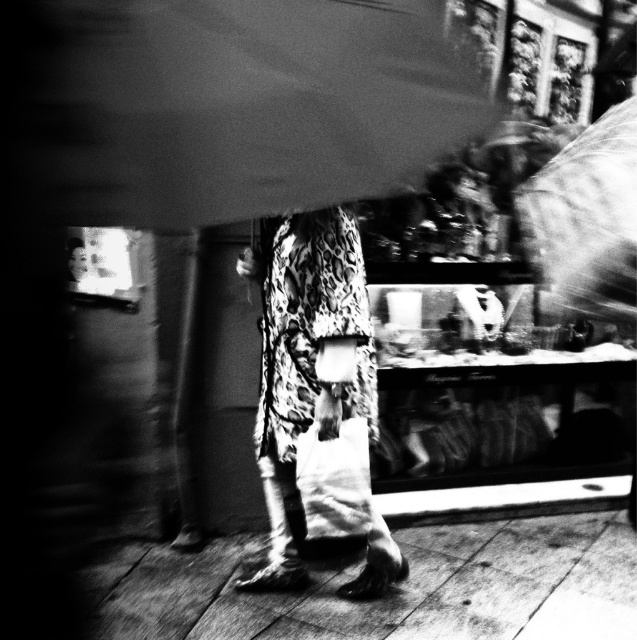
Is point (513, 586) positioned before point (280, 456)?

No, it is not.

Looking at this image, does smooth wooden floor at lower center appear on the left side of leopard print dress at center?

In fact, smooth wooden floor at lower center is to the right of leopard print dress at center.

Does point (587, 580) lie behind point (327, 307)?

Yes, point (587, 580) is farther from viewer.

You are a GUI agent. You are given a task and a screenshot of the screen. Output one action in this format:
    pyautogui.click(x=<x>, y=<y>)
    Task: Click on the smooth wooden floor at lower center
    The image size is (637, 640).
    Given the screenshot: What is the action you would take?
    pyautogui.click(x=394, y=588)

Based on the photo, is leopard print dress at center further to the viewer compared to transparent plastic umbrella at upper right?

Yes, it is.

Who is more distant from viewer, (287, 404) or (606, 288)?

Positioned behind is point (287, 404).

What do you see at coordinates (306, 358) in the screenshot?
I see `leopard print dress at center` at bounding box center [306, 358].

Locate an element on the screen. Image resolution: width=637 pixels, height=640 pixels. leopard print dress at center is located at coordinates (306, 358).

Is point (389, 193) behind point (626, 189)?

No.

Looking at this image, who is lower down, smooth fabric umbrella at upper center or transparent plastic umbrella at upper right?

Positioned lower is transparent plastic umbrella at upper right.

Identify the location of smooth fabric umbrella at upper center. This screenshot has height=640, width=637. (224, 106).